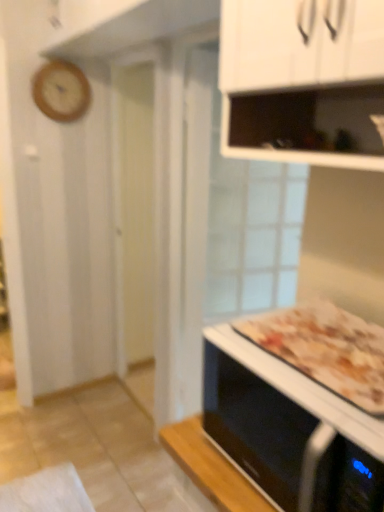
Question: Considering the relative sizes of wooden clock at upper left and black glossy microwave oven at lower right in the image provided, is wooden clock at upper left taller than black glossy microwave oven at lower right?

Choices:
 (A) yes
 (B) no

Answer: (A)

Question: Can you confirm if wooden clock at upper left is wider than black glossy microwave oven at lower right?

Choices:
 (A) yes
 (B) no

Answer: (B)

Question: Can you confirm if wooden clock at upper left is bigger than black glossy microwave oven at lower right?

Choices:
 (A) no
 (B) yes

Answer: (A)

Question: Is wooden clock at upper left not close to black glossy microwave oven at lower right?

Choices:
 (A) no
 (B) yes

Answer: (B)

Question: Is wooden clock at upper left to the right of black glossy microwave oven at lower right from the viewer's perspective?

Choices:
 (A) yes
 (B) no

Answer: (B)

Question: Is wooden clock at upper left with black glossy microwave oven at lower right?

Choices:
 (A) yes
 (B) no

Answer: (B)

Question: Considering the relative sizes of black glossy microwave oven at lower right and golden brown crusty pizza at lower right in the image provided, is black glossy microwave oven at lower right thinner than golden brown crusty pizza at lower right?

Choices:
 (A) no
 (B) yes

Answer: (A)

Question: Considering the relative sizes of black glossy microwave oven at lower right and golden brown crusty pizza at lower right in the image provided, is black glossy microwave oven at lower right smaller than golden brown crusty pizza at lower right?

Choices:
 (A) no
 (B) yes

Answer: (A)

Question: Is black glossy microwave oven at lower right facing away from golden brown crusty pizza at lower right?

Choices:
 (A) yes
 (B) no

Answer: (B)

Question: Can you confirm if black glossy microwave oven at lower right is wider than golden brown crusty pizza at lower right?

Choices:
 (A) yes
 (B) no

Answer: (A)

Question: Does black glossy microwave oven at lower right turn towards golden brown crusty pizza at lower right?

Choices:
 (A) yes
 (B) no

Answer: (B)

Question: From the image's perspective, is black glossy microwave oven at lower right located beneath golden brown crusty pizza at lower right?

Choices:
 (A) yes
 (B) no

Answer: (A)

Question: Does golden brown crusty pizza at lower right lie behind black glossy microwave oven at lower right?

Choices:
 (A) no
 (B) yes

Answer: (B)